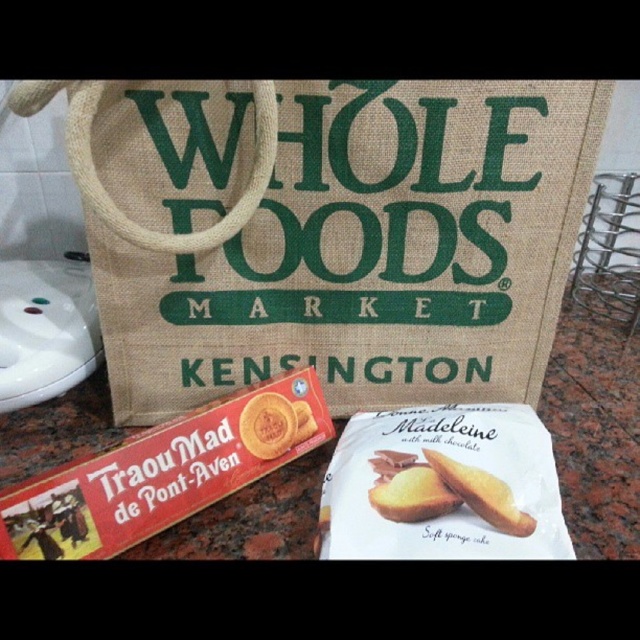
You are a delivery person who needs to place a new item on the countertop. The current items include the brown canvas tote bag with green lettering and the white paper madeleine at center. Where should you place the new item to avoid overlapping with the existing items? Please provide coordinates in the format of a point within the range of 0 to 1 for both x and y axes.

The white paper madeleine at center is located at point (x=444, y=486). To avoid overlapping, place the new item at a coordinate that is not (x=444, y=486). For example, placing it at (x=320, y=192) would be safe since it is away from the existing items.

Please write a question based on the given information without revealing the specific details in the Objects Description. The question should ask about the position of the golden sponge cake at center relative to other objects in the scene. Make sure to include all object labels from the Objects list in the question. The answer should use the Objects Description to provide the correct coordinates. The question must be phrased in a way that requires the answer to state the exact coordinates from the Objects.

The golden sponge cake at center is located at the coordinates point (481, 493).

What is located at the coordinates point (163, 472) on the countertop?

The red cardboard box of traou mad de pont aven cookies at lower left is located at point (163, 472) on the countertop.